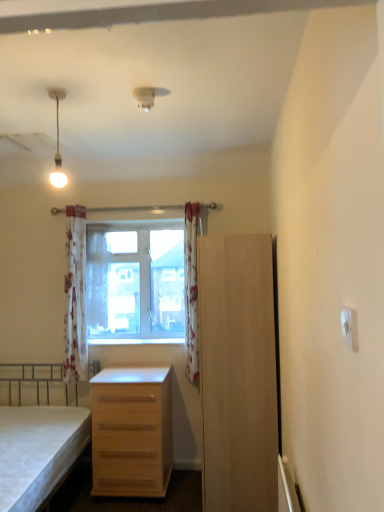
Image resolution: width=384 pixels, height=512 pixels. In order to click on free spot above white floral fabric curtain at center, which ranks as the second curtain in right-to-left order (from a real-world perspective) in this screenshot , I will do `click(97, 224)`.